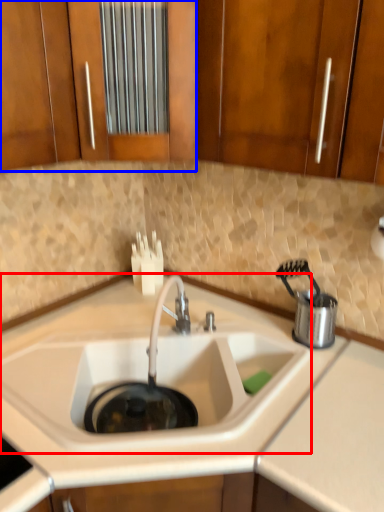
Question: Which object appears closest to the camera in this image, sink (highlighted by a red box) or cabinetry (highlighted by a blue box)?

Choices:
 (A) sink
 (B) cabinetry

Answer: (A)